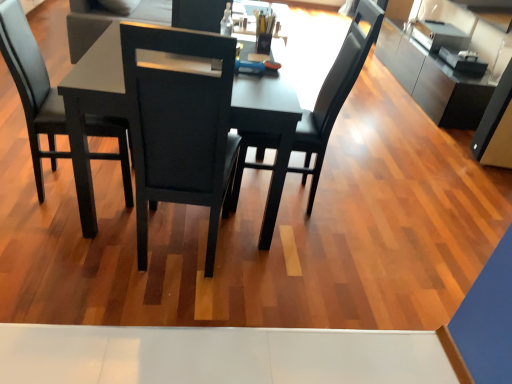
Question: Is satin silver cabinet at upper right smaller than black matte chair at center, which appears as the 2th chair when viewed from the left?

Choices:
 (A) no
 (B) yes

Answer: (A)

Question: From the image's perspective, is satin silver cabinet at upper right located above black matte chair at center, which appears as the 2th chair when viewed from the left?

Choices:
 (A) no
 (B) yes

Answer: (B)

Question: From a real-world perspective, is satin silver cabinet at upper right below black matte chair at center, which appears as the 2th chair when viewed from the left?

Choices:
 (A) yes
 (B) no

Answer: (A)

Question: Is satin silver cabinet at upper right outside black matte chair at center, the 1th chair when ordered from right to left?

Choices:
 (A) yes
 (B) no

Answer: (A)

Question: From the image's perspective, is satin silver cabinet at upper right under black matte chair at center, which appears as the 2th chair when viewed from the left?

Choices:
 (A) yes
 (B) no

Answer: (B)

Question: Is satin silver cabinet at upper right facing towards black matte chair at center, which appears as the 2th chair when viewed from the left?

Choices:
 (A) yes
 (B) no

Answer: (B)

Question: Considering the relative sizes of black matte chair at center, which appears as the 2th chair when viewed from the left, and black leather chair at left, the 2th chair in the right-to-left sequence, in the image provided, is black matte chair at center, which appears as the 2th chair when viewed from the left, shorter than black leather chair at left, the 2th chair in the right-to-left sequence,?

Choices:
 (A) yes
 (B) no

Answer: (B)

Question: Is black matte chair at center, the 1th chair when ordered from right to left, bigger than black leather chair at left, the 2th chair in the right-to-left sequence?

Choices:
 (A) yes
 (B) no

Answer: (A)

Question: From the image's perspective, does black matte chair at center, the 1th chair when ordered from right to left, appear lower than black leather chair at left, the first chair from the left?

Choices:
 (A) yes
 (B) no

Answer: (A)

Question: Is black matte chair at center, which appears as the 2th chair when viewed from the left, aimed at black leather chair at left, the 2th chair in the right-to-left sequence?

Choices:
 (A) no
 (B) yes

Answer: (B)

Question: Considering the relative positions of black matte chair at center, the 1th chair when ordered from right to left, and black leather chair at left, the first chair from the left, in the image provided, is black matte chair at center, the 1th chair when ordered from right to left, to the left of black leather chair at left, the first chair from the left, from the viewer's perspective?

Choices:
 (A) yes
 (B) no

Answer: (B)

Question: Can you confirm if black matte chair at center, the 1th chair when ordered from right to left, is wider than black leather chair at left, the 2th chair in the right-to-left sequence?

Choices:
 (A) no
 (B) yes

Answer: (B)

Question: Considering the relative sizes of matte black table at center and satin silver cabinet at upper right in the image provided, is matte black table at center smaller than satin silver cabinet at upper right?

Choices:
 (A) no
 (B) yes

Answer: (A)